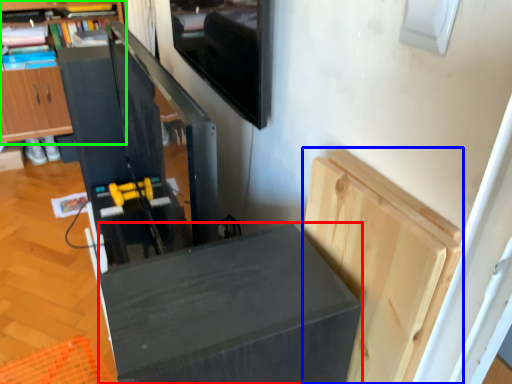
Question: Which is farther away from furniture (highlighted by a red box)? cabinetry (highlighted by a blue box) or cabinetry (highlighted by a green box)?

Choices:
 (A) cabinetry
 (B) cabinetry

Answer: (B)